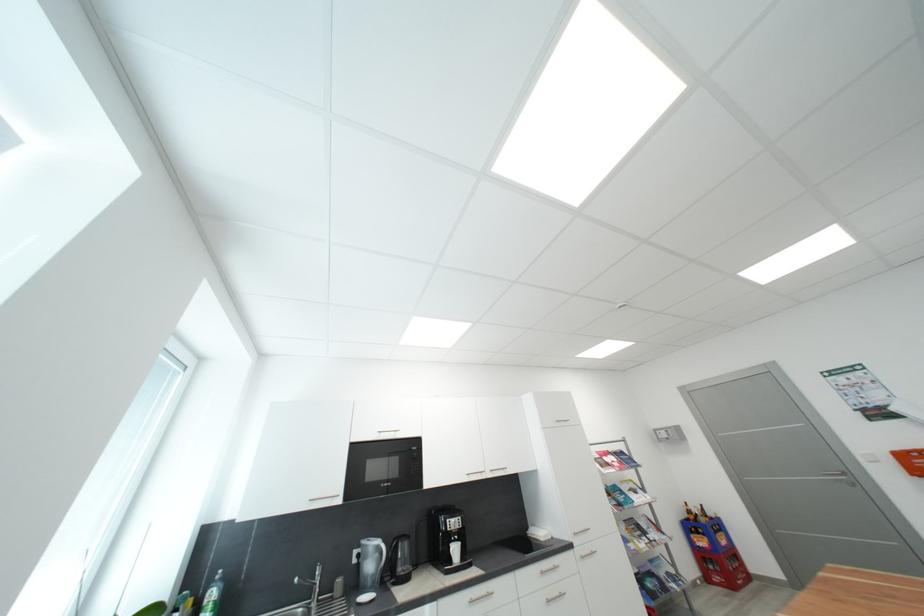
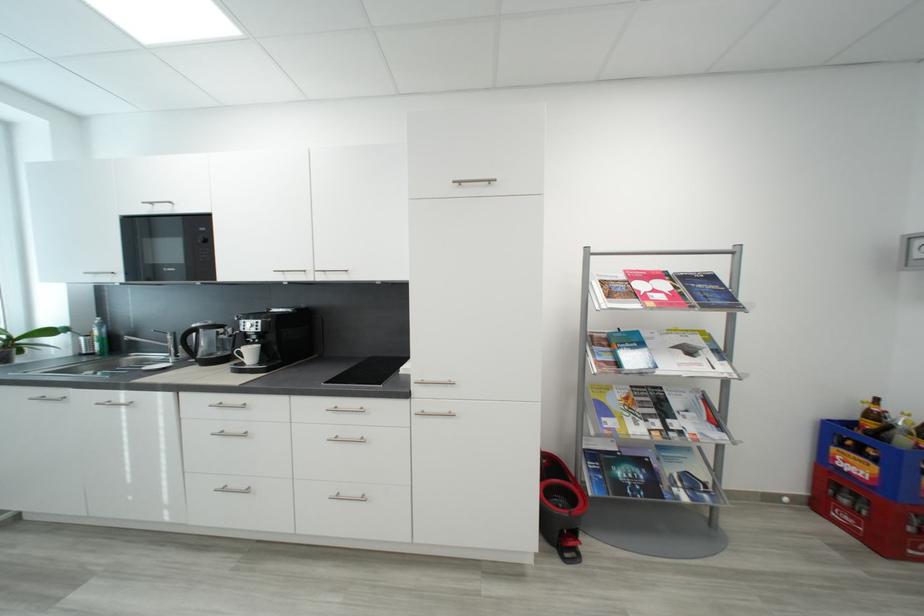
Find the pixel in the second image that matches (650,527) in the first image.

(684, 406)